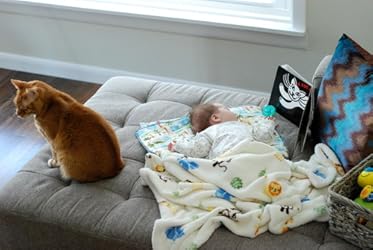
Find the location of a particular element. This screenshot has width=373, height=250. book is located at coordinates (296, 112).